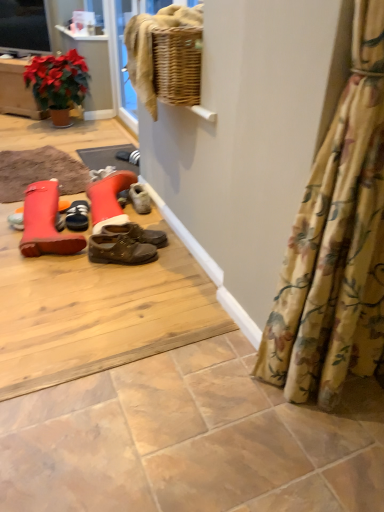
You are a GUI agent. You are given a task and a screenshot of the screen. Output one action in this format:
    pyautogui.click(x=<x>, y=<y>)
    Task: Click on the free location in front of leather boot at left, which is the 1th footwear from front to back
    The image size is (384, 512).
    Given the screenshot: What is the action you would take?
    47,274